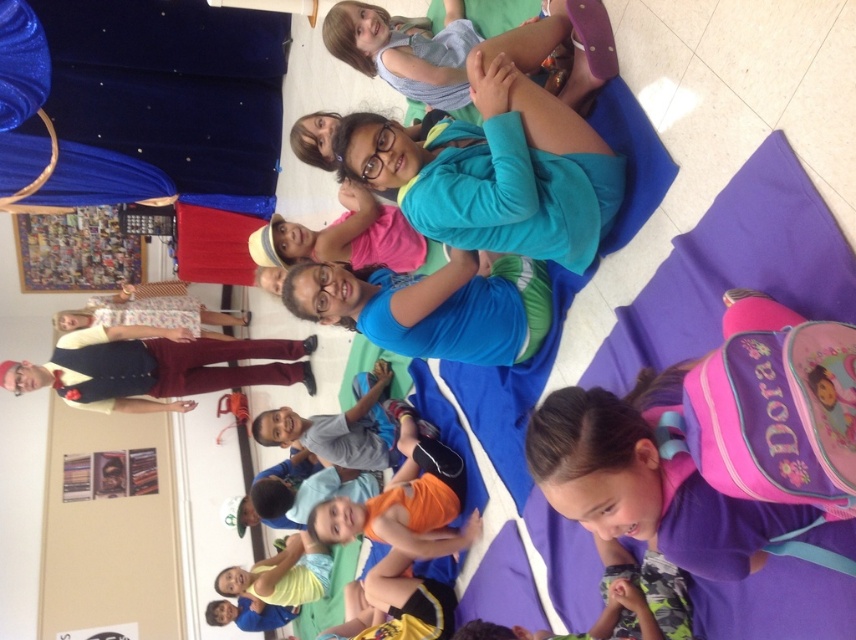
You are standing in the center of the room and see the point marked at coordinates (x=432, y=307). What object is located at that point?

The point at coordinates (x=432, y=307) marks the blue fabric at center.

Based on the photo, you are a parent trying to locate your child who is wearing maroon velvet pants at left. You are currently standing near the blue fabric at center. Can you walk directly to your child without moving any objects?

The distance between the blue fabric at center and the maroon velvet pants at left is 3.98 meters, so yes, you can walk directly to your child without needing to move any objects as the path is clear.